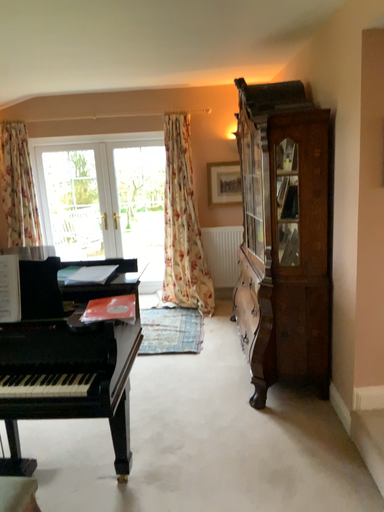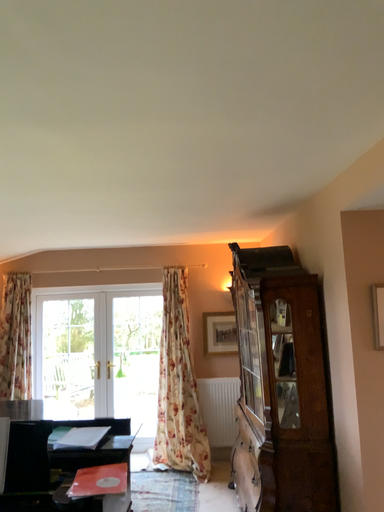
Question: How did the camera likely rotate when shooting the video?

Choices:
 (A) rotated downward
 (B) rotated upward

Answer: (B)